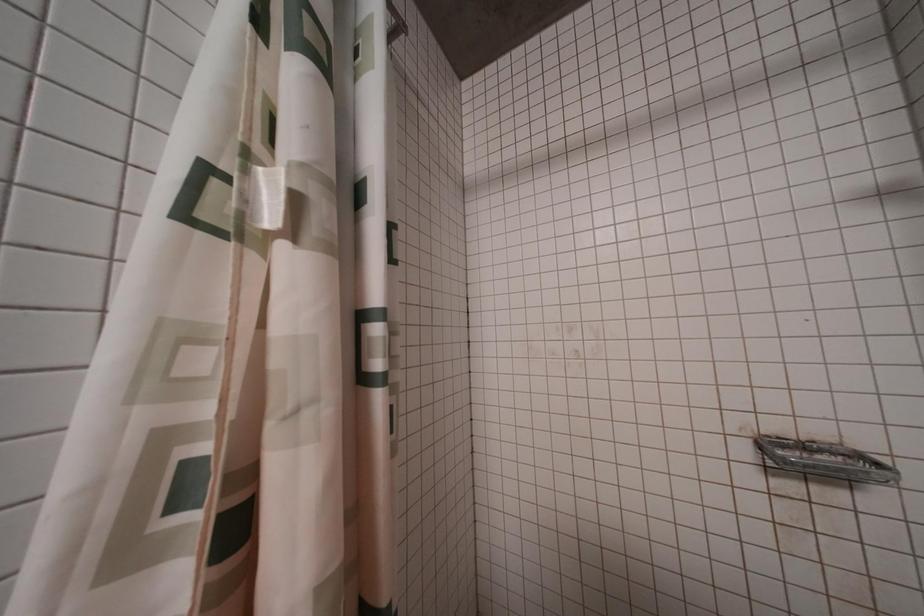
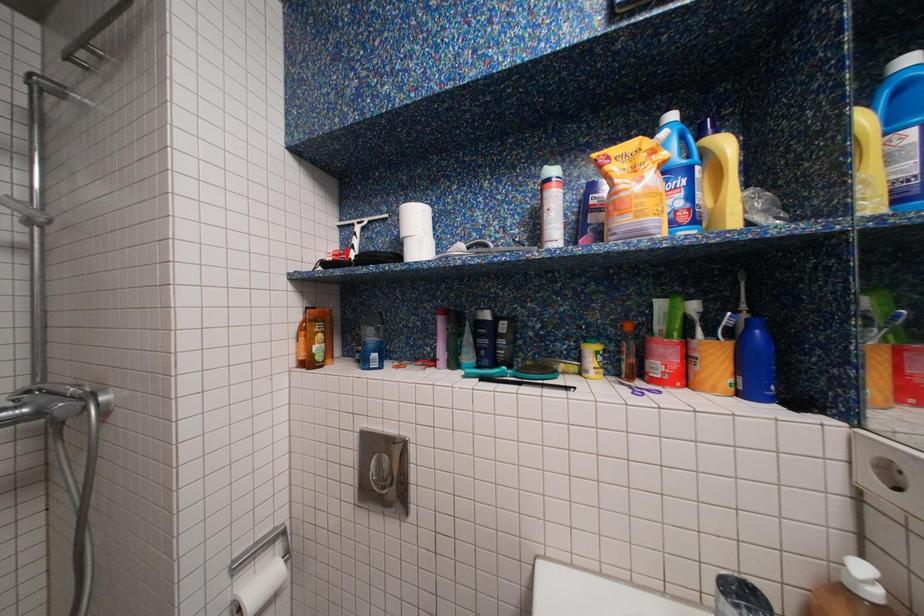
Question: Based on the continuous images, in which direction is the camera rotating? Reply with the corresponding letter.

Choices:
 (A) Left
 (B) Right
 (C) Up
 (D) Down

Answer: (B)